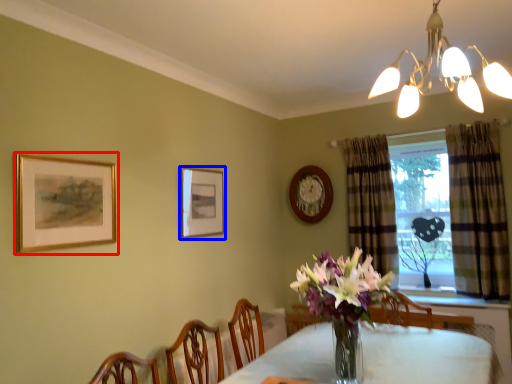
Question: Which point is closer to the camera, picture frame (highlighted by a red box) or picture frame (highlighted by a blue box)?

Choices:
 (A) picture frame
 (B) picture frame

Answer: (A)